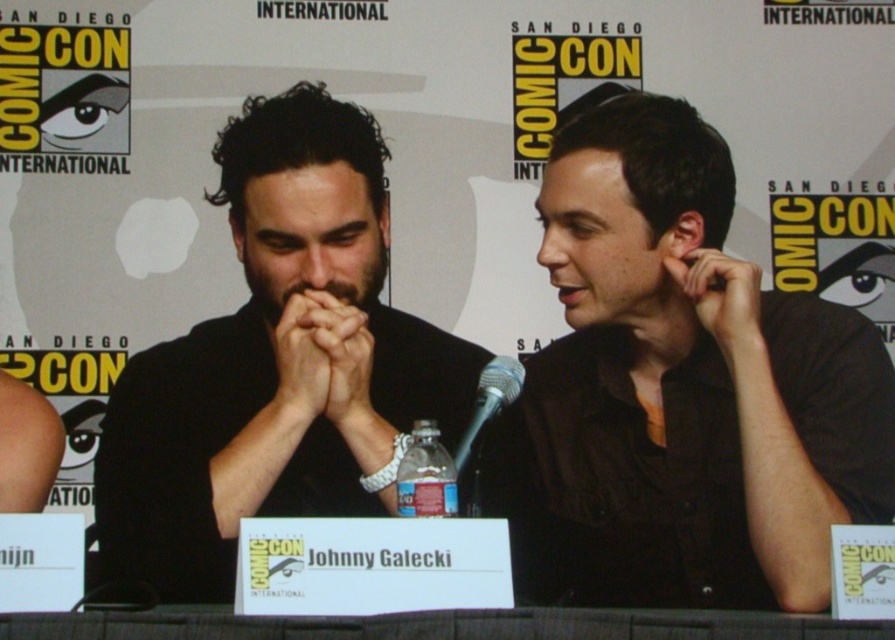
Question: Is black matte shirt at left bigger than silver metallic microphone at center?

Choices:
 (A) yes
 (B) no

Answer: (A)

Question: Which of the following is the farthest from the observer?

Choices:
 (A) black matte shirt at center
 (B) black matte shirt at left

Answer: (A)

Question: Which of the following is the farthest from the observer?

Choices:
 (A) black matte shirt at left
 (B) silver metallic microphone at center
 (C) black matte shirt at center

Answer: (B)

Question: Considering the real-world distances, which object is closest to the black matte shirt at center?

Choices:
 (A) silver metallic microphone at center
 (B) black matte shirt at left

Answer: (A)

Question: Where is black matte shirt at left located in relation to silver metallic microphone at center in the image?

Choices:
 (A) above
 (B) below

Answer: (A)

Question: Is black matte shirt at center smaller than black matte shirt at left?

Choices:
 (A) yes
 (B) no

Answer: (A)